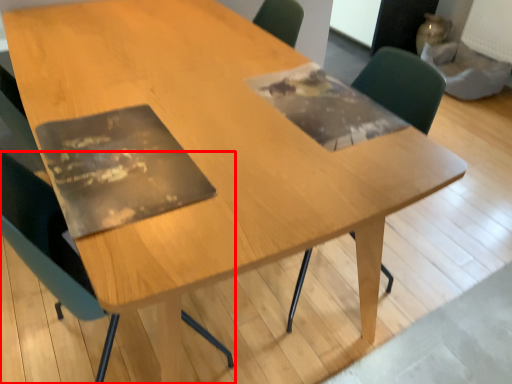
Question: Observing the image, what is the correct spatial positioning of chair (annotated by the red box) in reference to chair?

Choices:
 (A) left
 (B) right

Answer: (A)